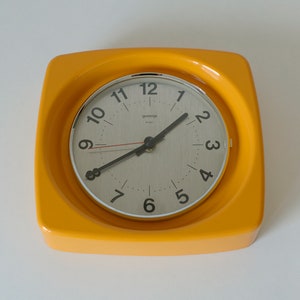
You are a GUI agent. You are given a task and a screenshot of the screen. Output one action in this format:
    pyautogui.click(x=<x>, y=<y>)
    Task: Click on the lower left corner of clock
    This screenshot has width=300, height=300.
    Given the screenshot: What is the action you would take?
    45,227